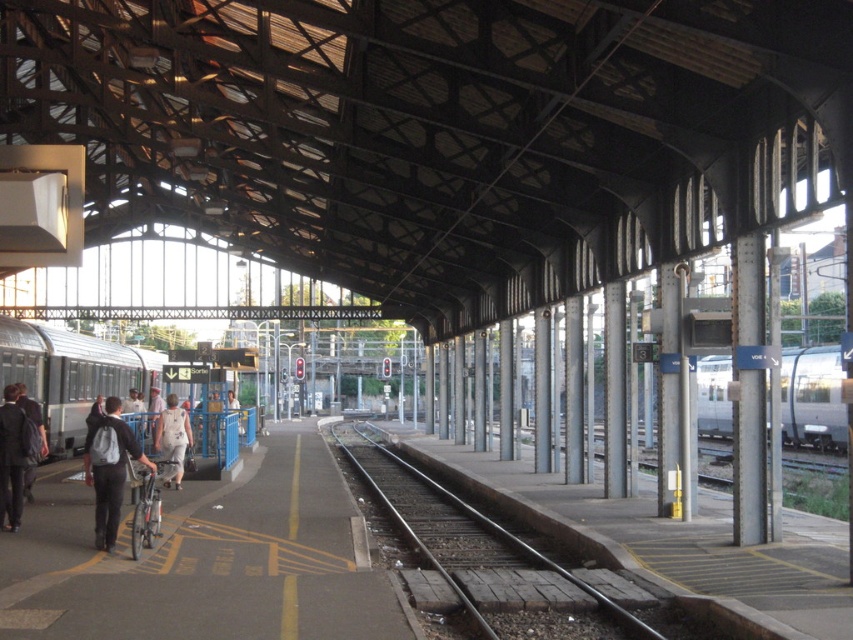
Does dark gray backpack at left have a greater height compared to white cotton dress at center?

Indeed, dark gray backpack at left has a greater height compared to white cotton dress at center.

Does dark gray backpack at left have a greater width compared to white cotton dress at center?

No, dark gray backpack at left is not wider than white cotton dress at center.

At what (x,y) coordinates should I click in order to perform the action: click on dark gray backpack at left. Please return your answer as a coordinate pair (x, y). Looking at the image, I should click on (13, 456).

You are a GUI agent. You are given a task and a screenshot of the screen. Output one action in this format:
    pyautogui.click(x=<x>, y=<y>)
    Task: Click on the dark gray backpack at left
    
    Given the screenshot: What is the action you would take?
    pyautogui.click(x=13, y=456)

Can you confirm if silver metallic train at left is positioned to the right of dark gray suit at left?

In fact, silver metallic train at left is to the left of dark gray suit at left.

Is silver metallic train at left bigger than dark gray suit at left?

Correct, silver metallic train at left is larger in size than dark gray suit at left.

Is point (28, 365) in front of point (19, 387)?

That is False.

What are the coordinates of `silver metallic train at left` in the screenshot? It's located at (70, 374).

Is dark gray backpack at lower left taller than dark gray backpack at left?

Correct, dark gray backpack at lower left is much taller as dark gray backpack at left.

Is point (123, 477) less distant than point (24, 444)?

Yes.

This screenshot has width=853, height=640. Find the location of `dark gray backpack at lower left`. dark gray backpack at lower left is located at coordinates (109, 468).